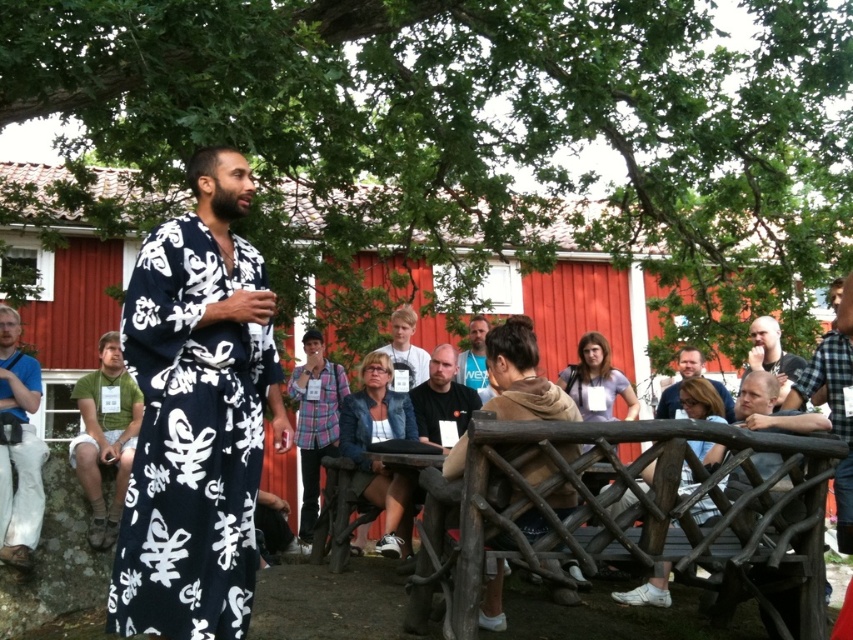
Who is lower down, green fabric shorts at lower left or black matte shirt at center?

green fabric shorts at lower left is below.

Between point (108, 426) and point (461, 412), which one is positioned in front?

Point (108, 426) is more forward.

Locate an element on the screen. green fabric shorts at lower left is located at coordinates (105, 435).

Identify the location of green fabric shorts at lower left. (105, 435).

Is point (730, 419) positioned after point (486, 376)?

No, it is not.

Does smooth brown leather jacket at lower right have a greater height compared to matte black shirt at center?

No, smooth brown leather jacket at lower right is not taller than matte black shirt at center.

Is point (688, 348) closer to camera compared to point (469, 365)?

Yes, point (688, 348) is closer to viewer.

This screenshot has height=640, width=853. I want to click on smooth brown leather jacket at lower right, so click(x=679, y=381).

Between plaid fabric shirt at center and matte black shirt at center, which one appears on the right side from the viewer's perspective?

matte black shirt at center is more to the right.

Can you confirm if plaid fabric shirt at center is thinner than matte black shirt at center?

In fact, plaid fabric shirt at center might be wider than matte black shirt at center.

Identify the location of plaid fabric shirt at center. Image resolution: width=853 pixels, height=640 pixels. (315, 429).